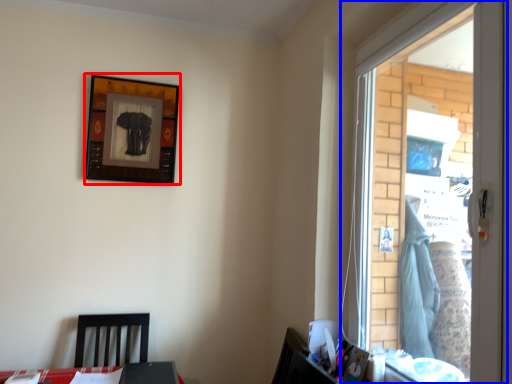
Question: Which object appears farthest to the camera in this image, picture frame (highlighted by a red box) or window (highlighted by a blue box)?

Choices:
 (A) picture frame
 (B) window

Answer: (A)